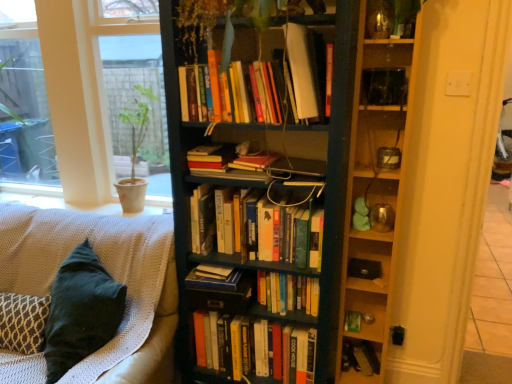
This screenshot has height=384, width=512. I want to click on empty space that is ontop of hardcover books at center, arranged as the 7th book when ordered from the bottom, so click(x=214, y=142).